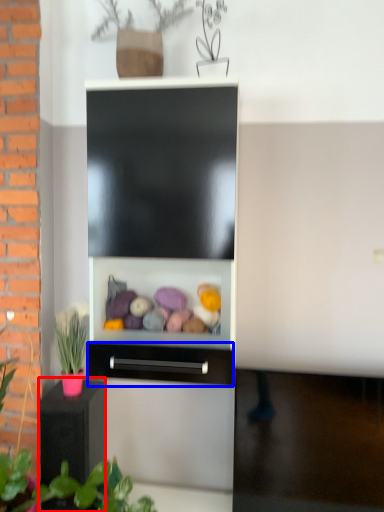
Question: Which object appears closest to the camera in this image, furniture (highlighted by a red box) or drawer (highlighted by a blue box)?

Choices:
 (A) furniture
 (B) drawer

Answer: (B)